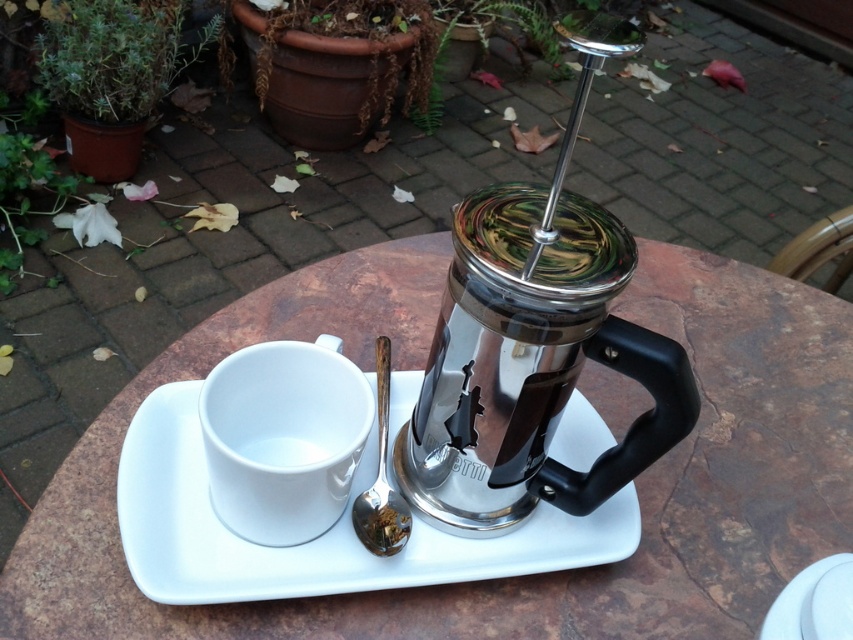
Who is shorter, metallic brown table at center or white glossy mug at center?

Standing shorter between the two is white glossy mug at center.

Which is below, metallic brown table at center or white glossy mug at center?

Positioned lower is white glossy mug at center.

Between point (552, 618) and point (248, 436), which one is positioned behind?

The point (248, 436) is more distant.

Find the location of a particular element. This screenshot has height=640, width=853. metallic brown table at center is located at coordinates (514, 577).

Consider the image. Between white ceramic saucer at center and white ceramic mug at center, which one has more height?

white ceramic saucer at center is taller.

Between point (364, 481) and point (286, 464), which one is positioned in front?

Positioned in front is point (286, 464).

Identify the location of white ceramic saucer at center. (318, 536).

Which is behind, point (757, 433) or point (292, 438)?

Positioned behind is point (757, 433).

Is point (848, 538) less distant than point (296, 440)?

That is False.

Find the location of a particular element. metallic brown table at center is located at coordinates (514, 577).